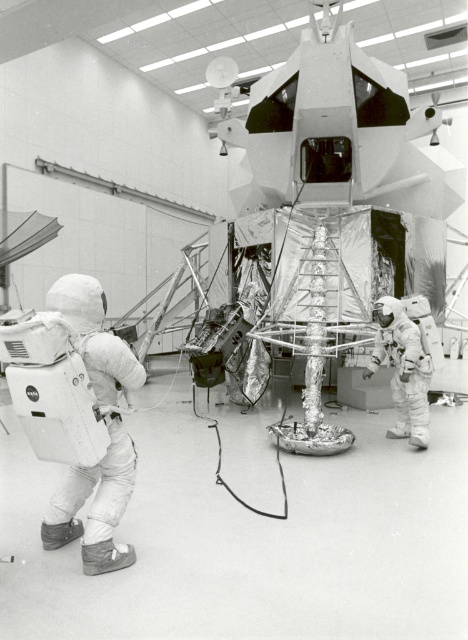
You are an astronaut in the space simulation facility. You see two points marked on the lunar module mockup. Which point is closer to you, point at coordinate (65,284) or point at coordinate (393,428)?

Point at coordinate (65,284) is closer to you than point at coordinate (393,428).

Looking at this image, based on the scene description, where is the white fabric spacesuit at left located in the image?

The white fabric spacesuit at left is located at point (x=95, y=504).